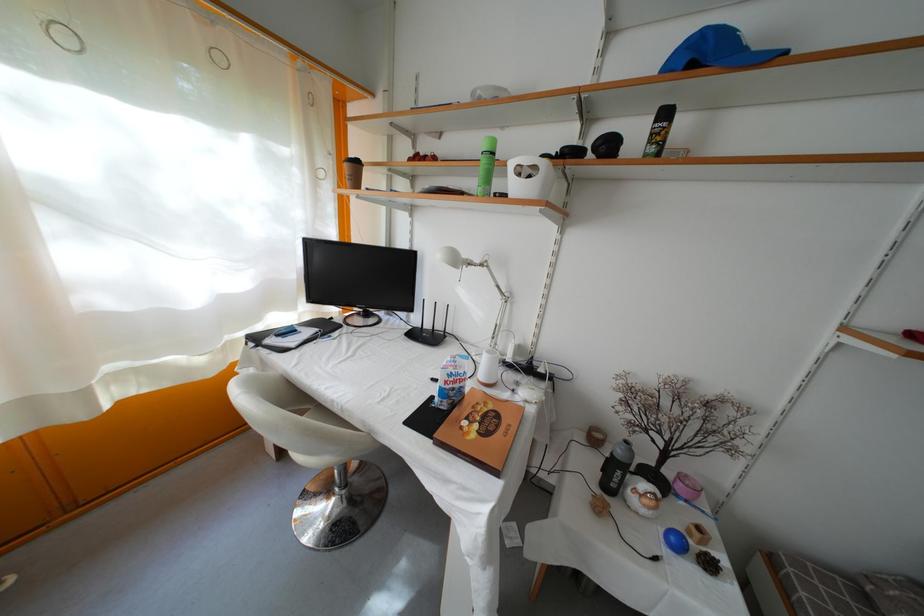
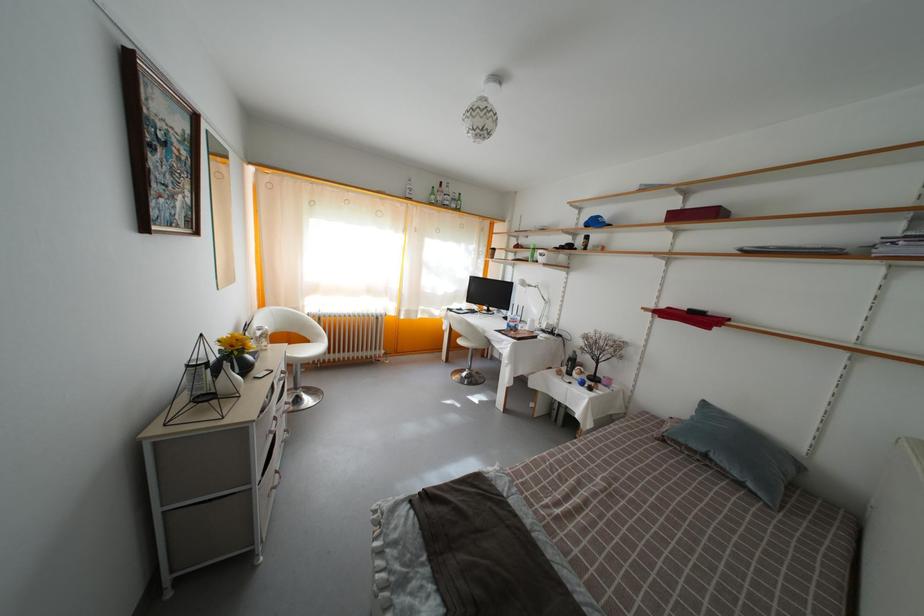
Where in the second image is the point corresponding to point (469, 262) from the first image?

(533, 289)